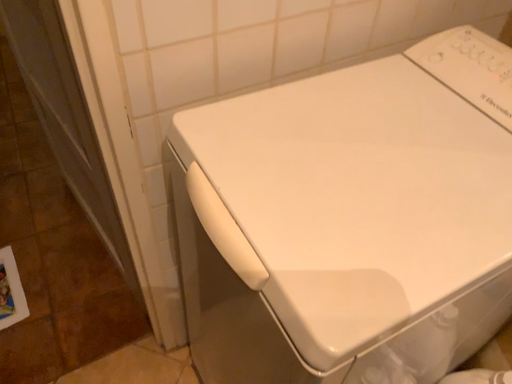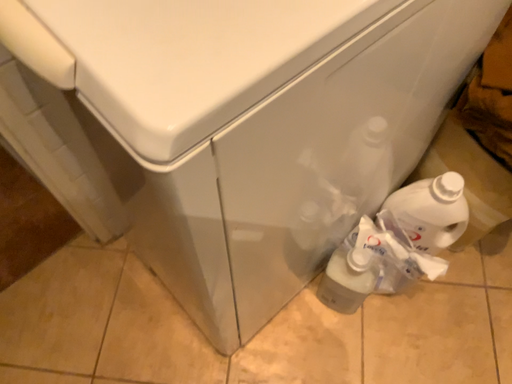
Question: How did the camera likely rotate when shooting the video?

Choices:
 (A) rotated right
 (B) rotated left

Answer: (A)